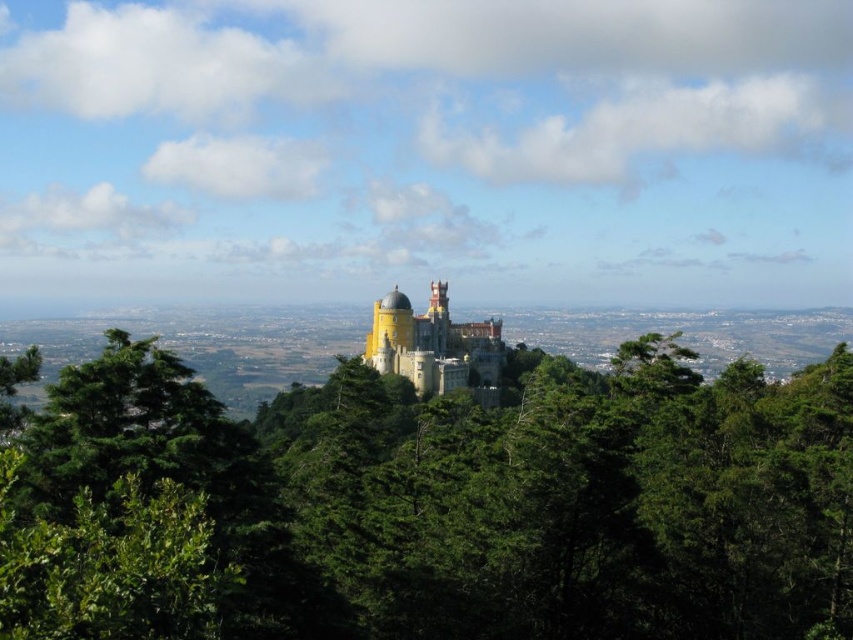
What are the coordinates of the green leafy tree at center?

The green leafy tree at center is located at coordinates point (492, 493).

You are standing in front of the castle and notice two points marked on the castle wall. One is at coordinate point (627, 630) and the other at point (495, 403). If you were to walk towards the castle, which point would you encounter first?

Point (627, 630) is further to the viewer than point (495, 403), so you would encounter point (627, 630) first as you approach the castle.